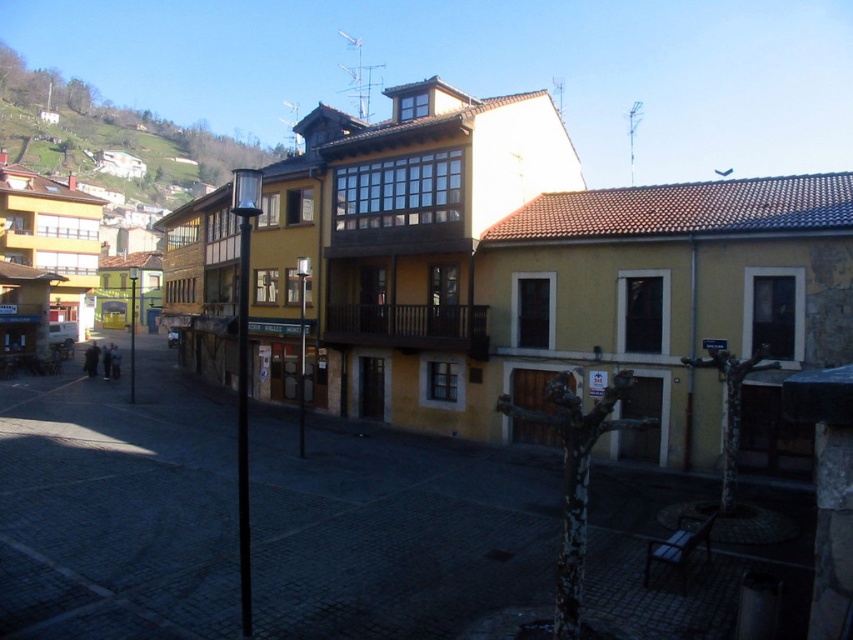
Question: Can you confirm if yellow matte building at center is bigger than green grassy hillside at upper left?

Choices:
 (A) yes
 (B) no

Answer: (B)

Question: Which point is farther to the camera?

Choices:
 (A) (274, 492)
 (B) (107, 124)

Answer: (B)

Question: Does yellow matte building at center appear on the right side of green grassy hillside at upper left?

Choices:
 (A) yes
 (B) no

Answer: (A)

Question: From the image, what is the correct spatial relationship of yellow matte building at center in relation to green grassy hillside at upper left?

Choices:
 (A) below
 (B) above

Answer: (A)